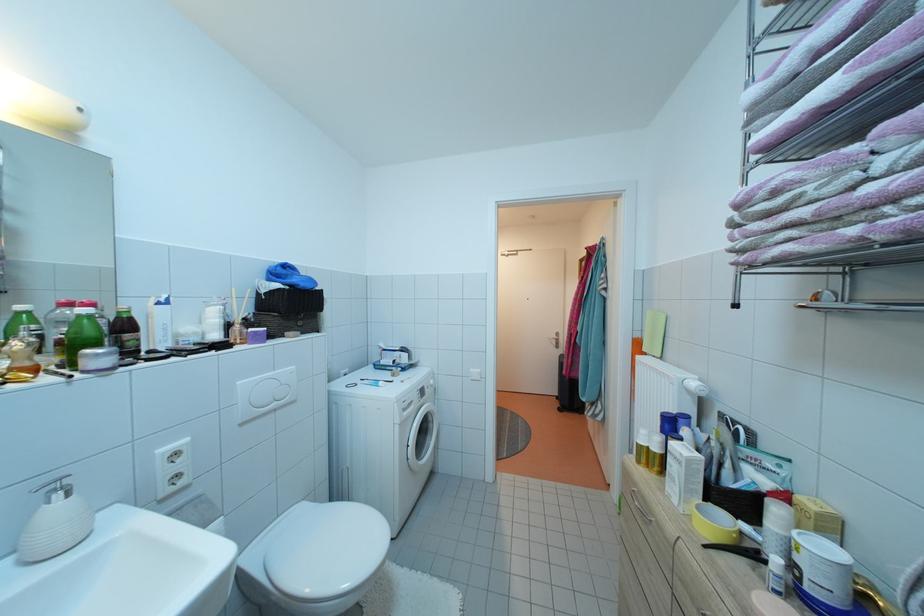
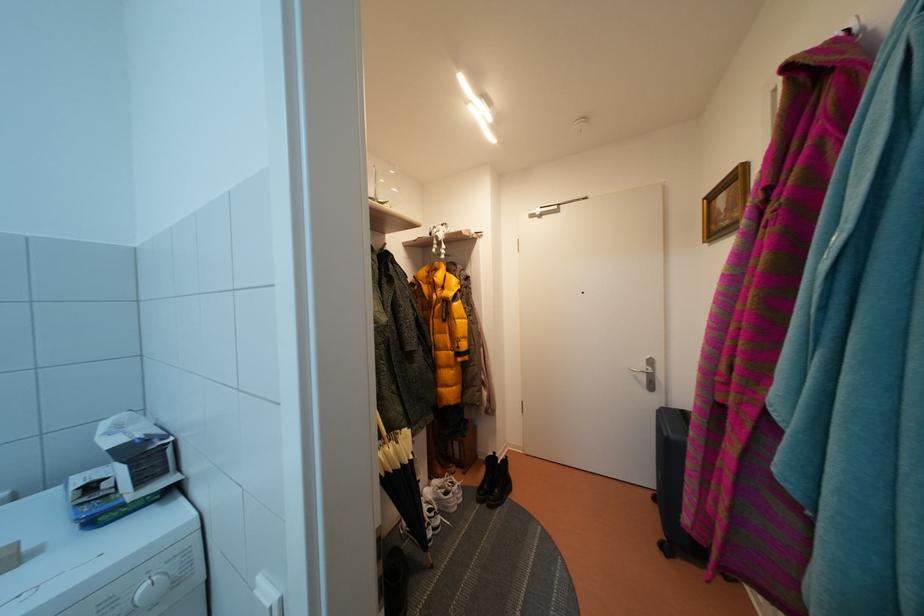
In the second image, find the point that corresponds to (x=562, y=342) in the first image.

(650, 371)